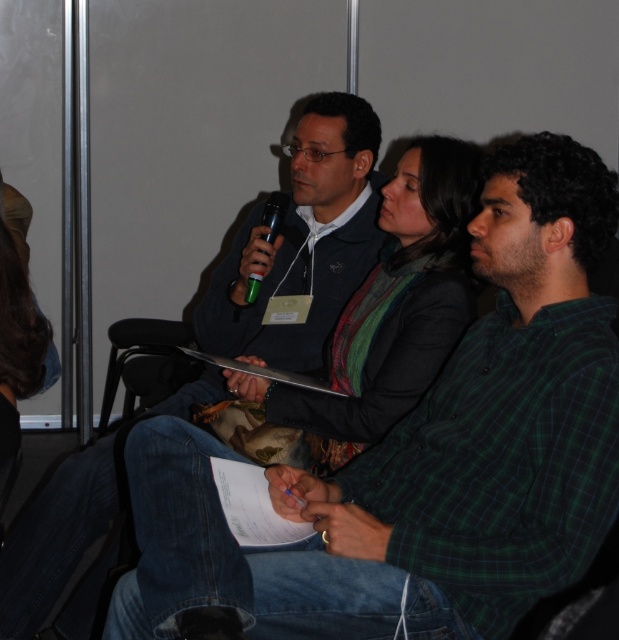
Is green plaid shirt at center further to camera compared to dark blue jeans at center?

No, it is not.

Is green plaid shirt at center taller than dark blue jeans at center?

Incorrect, green plaid shirt at center's height is not larger of dark blue jeans at center's.

Between point (170, 480) and point (373, 161), which one is positioned in front?

Point (170, 480)

In order to click on green plaid shirt at center in this screenshot , I will do `click(423, 458)`.

Does point (607, 308) lie behind point (256, 285)?

No, (607, 308) is closer to viewer.

Describe the element at coordinates (423, 458) in the screenshot. This screenshot has height=640, width=619. I see `green plaid shirt at center` at that location.

Does point (368, 506) lie behind point (272, 198)?

No, (368, 506) is in front of (272, 198).

Locate an element on the screen. green plaid shirt at center is located at coordinates (423, 458).

Can you confirm if dark blue jeans at center is positioned below green plastic microphone at center?

Correct, dark blue jeans at center is located below green plastic microphone at center.

Does dark blue jeans at center appear on the left side of green plastic microphone at center?

Correct, you'll find dark blue jeans at center to the left of green plastic microphone at center.

Is point (113, 461) positioned behind point (249, 285)?

That is False.

Locate an element on the screen. The width and height of the screenshot is (619, 640). dark blue jeans at center is located at coordinates click(x=303, y=241).